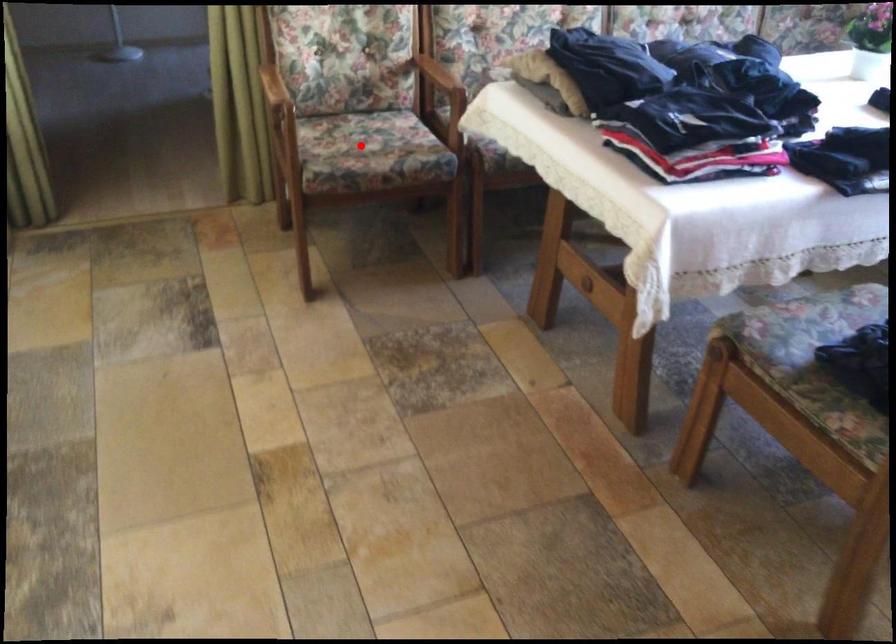
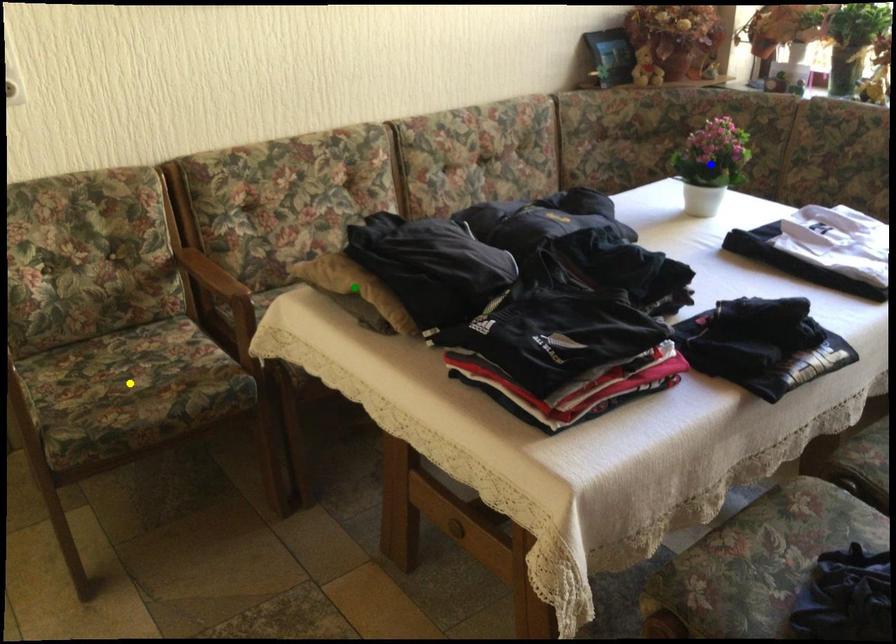
Question: I am providing you with two images of the same scene from different viewpoints. A red point is marked on the first image. You are given multiple points on the second image. Which point in image 2 represents the same 3d spot as the red point in image 1?

Choices:
 (A) green point
 (B) yellow point
 (C) blue point

Answer: (B)